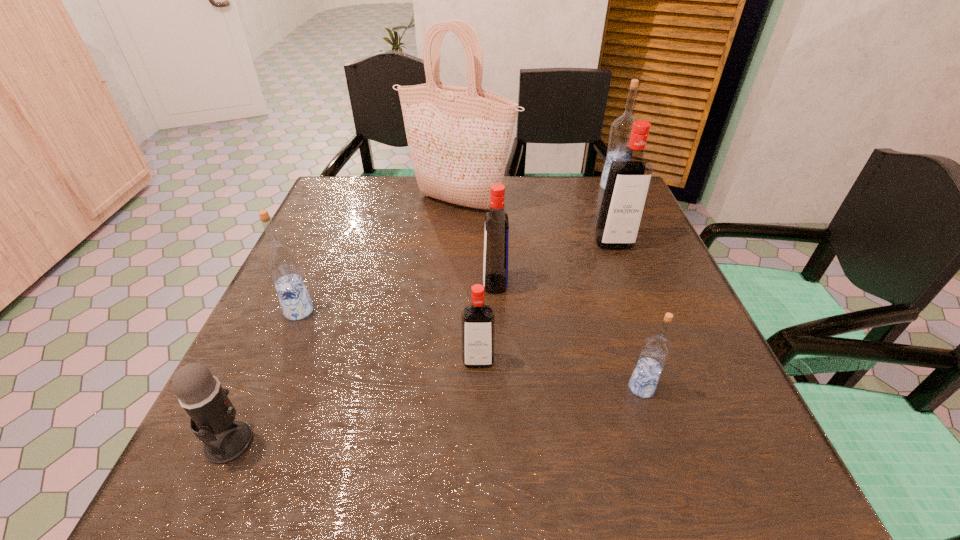
Locate an element on the screen. This screenshot has width=960, height=540. object positioned at the near left corner is located at coordinates (212, 414).

Locate an element on the screen. The width and height of the screenshot is (960, 540). object present at the far right corner is located at coordinates (620, 131).

Identify the location of vacant point at the far edge. (539, 185).

In the image, there is a desktop. Where is `blank space at the near edge`? The width and height of the screenshot is (960, 540). blank space at the near edge is located at coordinates (370, 488).

This screenshot has height=540, width=960. I want to click on free space at the left edge, so click(317, 239).

At what (x,y) coordinates should I click in order to perform the action: click on vacant space at the right edge of the desktop. Please return your answer as a coordinate pair (x, y). This screenshot has height=540, width=960. Looking at the image, I should click on (639, 287).

Identify the location of vacant area that lies between the biggest blue vodka and the fifth farthest object. (456, 249).

The width and height of the screenshot is (960, 540). In order to click on unoccupied position between the nearest red vodka and the tallest object in this screenshot , I will do `click(468, 282)`.

Locate an element on the screen. The width and height of the screenshot is (960, 540). free space between the shopping bag and the farthest vodka is located at coordinates (536, 195).

Image resolution: width=960 pixels, height=540 pixels. I want to click on free space between the farthest vodka and the third farthest vodka, so click(x=554, y=235).